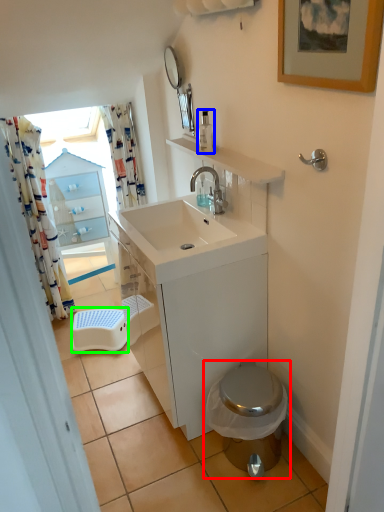
Question: Which object is the closest to the toilet (highlighted by a red box)? Choose among these: soap dispenser (highlighted by a blue box) or step stool (highlighted by a green box).

Choices:
 (A) soap dispenser
 (B) step stool

Answer: (B)